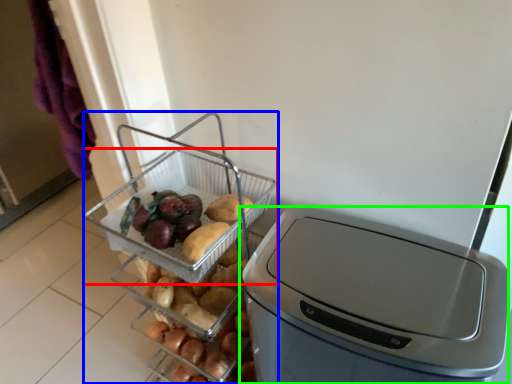
Question: Considering the real-world distances, which object is farthest from basket (highlighted by a red box)? appliance (highlighted by a blue box) or home appliance (highlighted by a green box)?

Choices:
 (A) appliance
 (B) home appliance

Answer: (B)